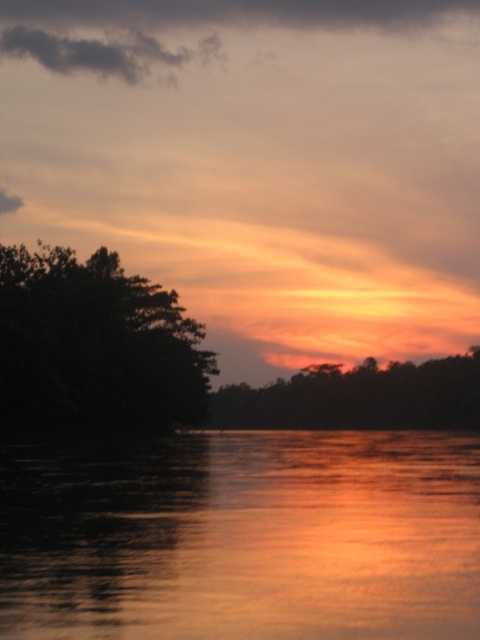
Question: Which object is the farthest from the dark green leafy tree at left?

Choices:
 (A) glossy water at center
 (B) silhouette tree at center

Answer: (B)

Question: Can you confirm if glossy water at center is thinner than silhouette tree at center?

Choices:
 (A) no
 (B) yes

Answer: (B)

Question: Does glossy water at center have a smaller size compared to dark green leafy tree at left?

Choices:
 (A) no
 (B) yes

Answer: (A)

Question: Is glossy water at center wider than silhouette tree at center?

Choices:
 (A) no
 (B) yes

Answer: (A)

Question: Which object is positioned farthest from the glossy water at center?

Choices:
 (A) silhouette tree at center
 (B) dark green leafy tree at left

Answer: (A)

Question: Which point appears farthest from the camera in this image?

Choices:
 (A) (92, 570)
 (B) (40, 376)
 (C) (323, 406)

Answer: (C)